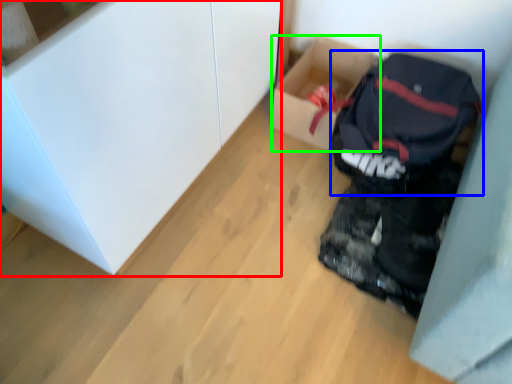
Question: Which object is the closest to the cabinetry (highlighted by a red box)? Choose among these: backpack (highlighted by a blue box) or box (highlighted by a green box).

Choices:
 (A) backpack
 (B) box

Answer: (B)